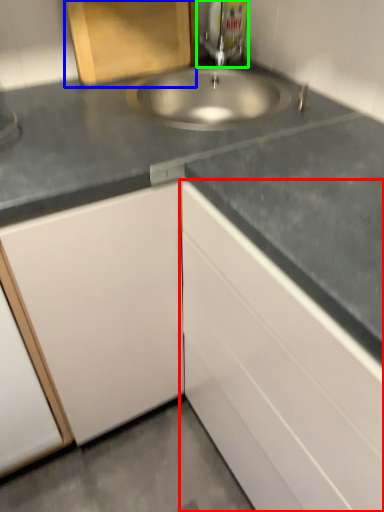
Question: Based on their relative distances, which object is nearer to cabinetry (highlighted by a red box)? Choose from cabinetry (highlighted by a blue box) and tap (highlighted by a green box).

Choices:
 (A) cabinetry
 (B) tap

Answer: (A)